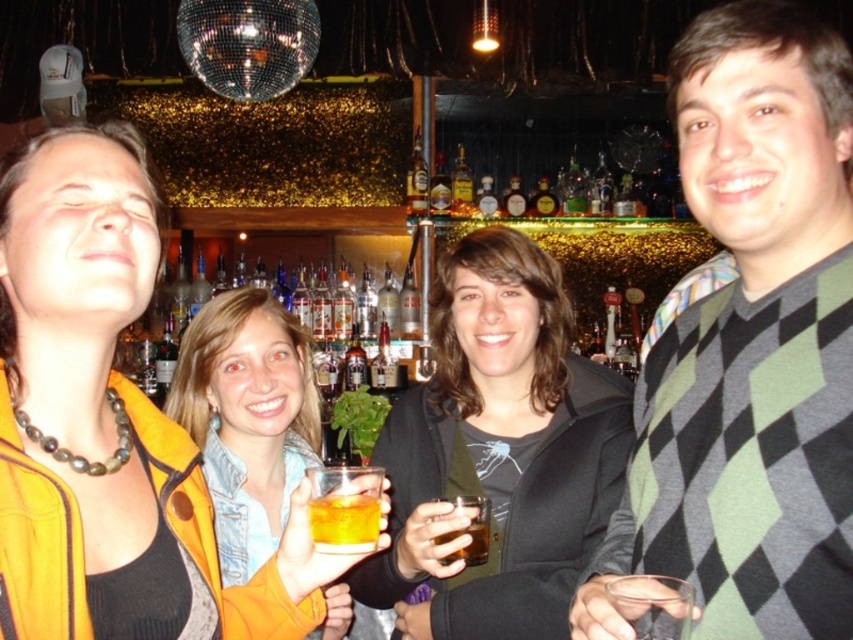
You are a bartender at the bar and you need to serve a customer who prefers a drink with a straw. Which of the two translucent glasses, the translucent glass at center or the translucent glass at lower right, would you choose?

The translucent glass at center is much taller than the translucent glass at lower right, so the taller glass would be better for a drink with a straw.

You are a bartender at the bar and need to serve two customers. You have a translucent glass at center and a translucent glass at lower right. Which glass should you choose if you want to serve a larger drink?

The translucent glass at center has a larger size compared to the translucent glass at lower right, so you should choose the translucent glass at center to serve a larger drink.

You are a bartender who needs to deliver a drink to the customer wearing the black matte jacket at center. The drink is currently placed at the translucent glass at lower right. Considering the distance between them is 37.17 inches, can you hand the drink to the customer without moving the glass?

The black matte jacket at center and translucent glass at lower right are 37.17 inches apart, so the bartender can hand the drink to the customer by picking up the drink from the translucent glass at lower right and walking the 37.17 inches distance to deliver it to the customer wearing the black matte jacket at center.